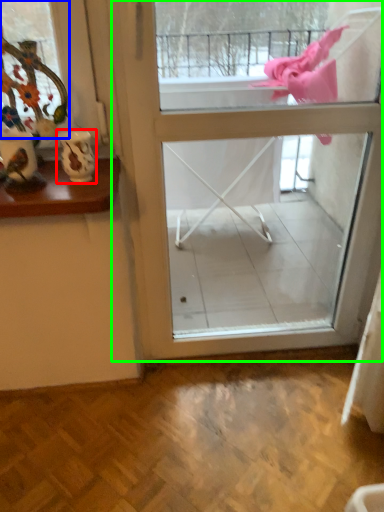
Question: Estimate the real-world distances between objects in this image. Which object is farther from vase (highlighted by a red box), window (highlighted by a blue box) or screen door (highlighted by a green box)?

Choices:
 (A) window
 (B) screen door

Answer: (B)